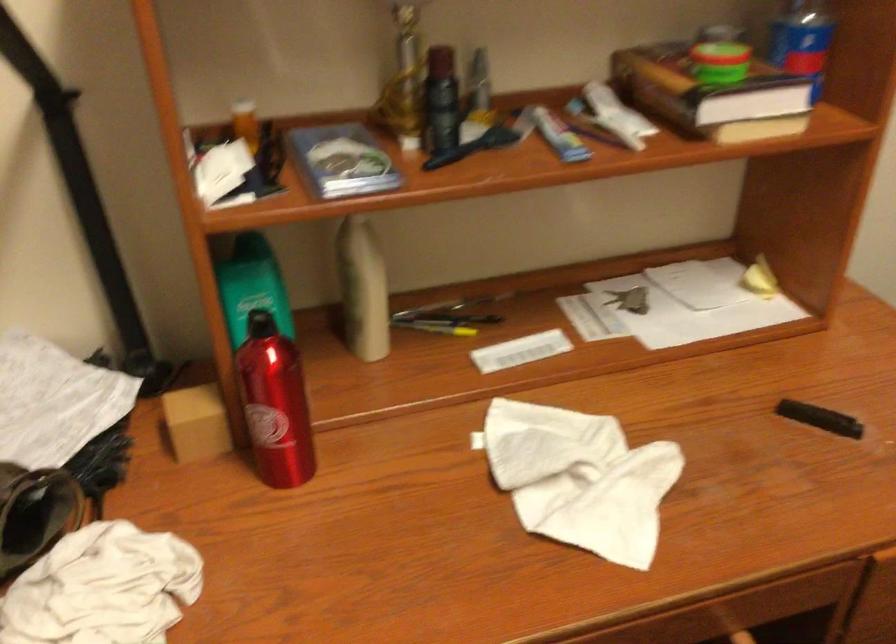
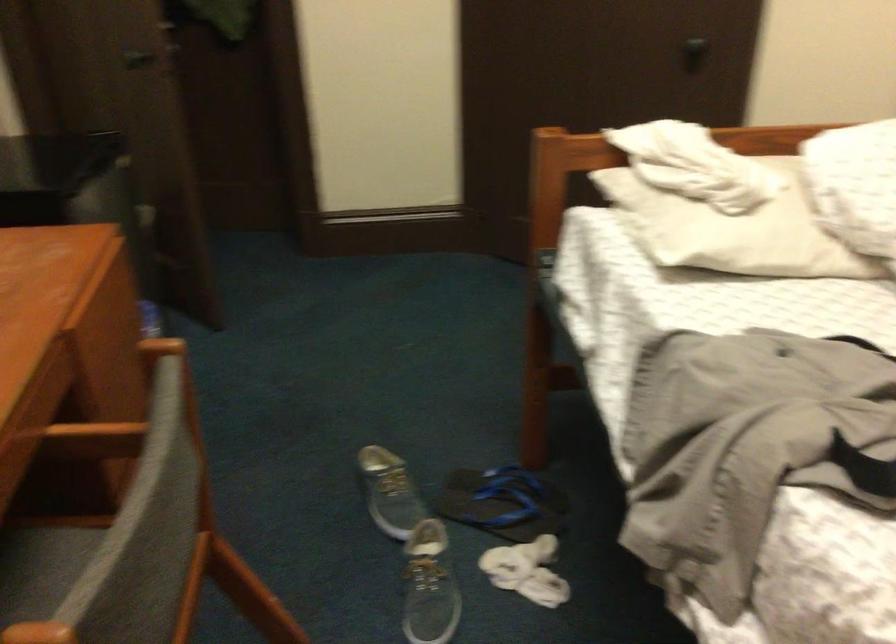
The images are taken continuously from a first-person perspective. In which direction is your viewpoint rotating?

The camera's rotation is toward right-down.